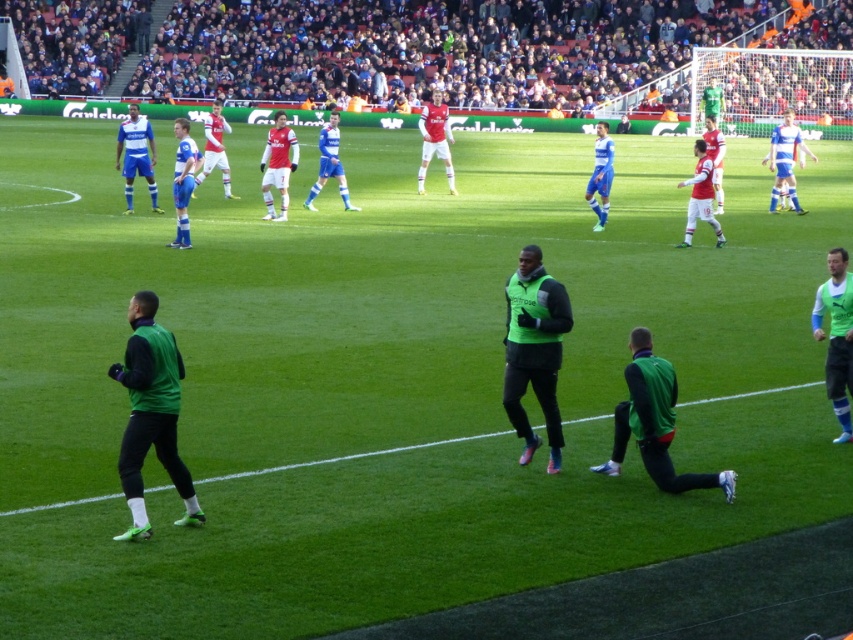
Can you confirm if green matte vest at center is taller than white jersey at center?

No.

Identify the location of green matte vest at center. [654, 422].

Which is in front, point (627, 387) or point (228, 179)?

Point (627, 387) is in front.

Identify the location of green matte vest at center. Image resolution: width=853 pixels, height=640 pixels. (654, 422).

Who is more distant from viewer, (151,163) or (596,148)?

Point (151,163)

Can you confirm if matte blue shorts at center is bigger than blue matte jersey at center?

Correct, matte blue shorts at center is larger in size than blue matte jersey at center.

Identify the location of matte blue shorts at center. The image size is (853, 640). (136, 156).

Does point (550, 429) come closer to viewer compared to point (141, 161)?

Yes, it is in front of point (141, 161).

Identify the location of green matte jacket at center. (534, 349).